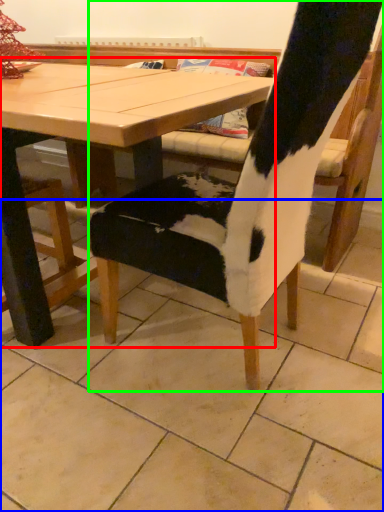
Question: Which is farther away from table (highlighted by a red box)? tile (highlighted by a blue box) or chair (highlighted by a green box)?

Choices:
 (A) tile
 (B) chair

Answer: (A)